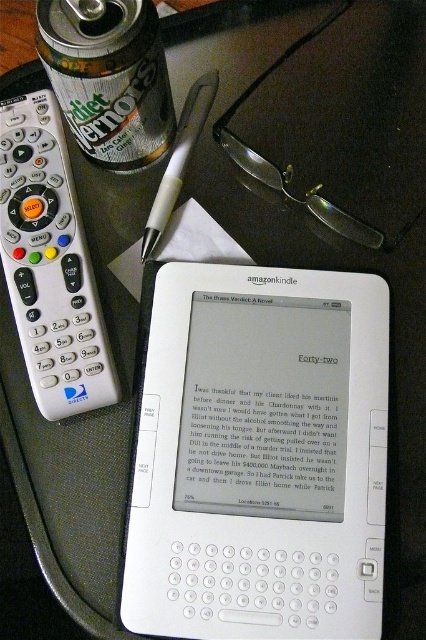
Question: Which point is farther to the camera?

Choices:
 (A) (244, 451)
 (B) (164, 221)
 (C) (135, 99)
 (D) (20, 269)

Answer: (B)

Question: Does white plastic kindle at center have a larger size compared to white plastic pen at center?

Choices:
 (A) no
 (B) yes

Answer: (B)

Question: Which of the following is the closest to the observer?

Choices:
 (A) white plastic remote at left
 (B) white plastic pen at center

Answer: (A)

Question: Does white plastic kindle at center appear over white plastic pen at center?

Choices:
 (A) no
 (B) yes

Answer: (A)

Question: Which point is closer to the camera taking this photo?

Choices:
 (A) (69, 340)
 (B) (238, 376)
 (C) (129, 36)
 (D) (210, 83)

Answer: (C)

Question: Does white plastic kindle at center appear on the right side of white plastic pen at center?

Choices:
 (A) no
 (B) yes

Answer: (B)